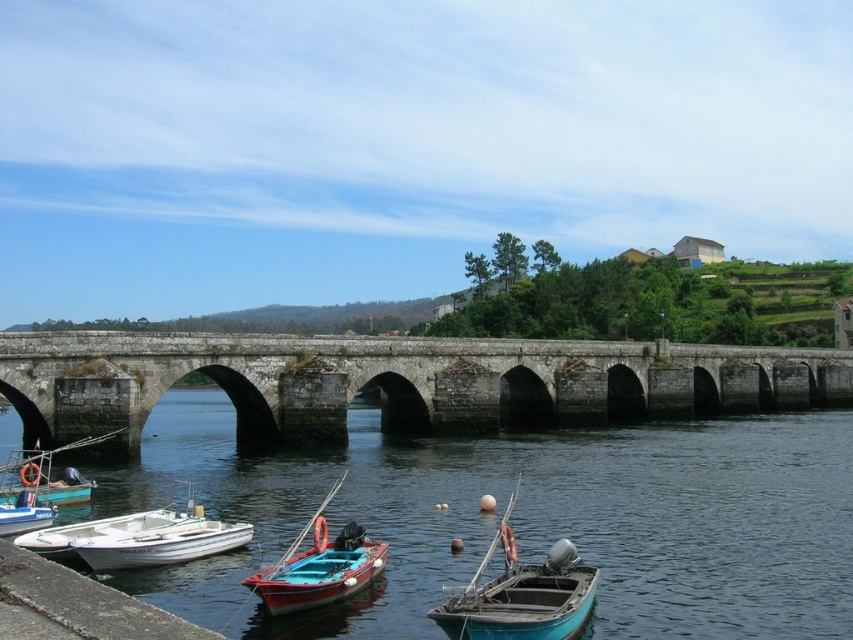
Question: Which is farther from the clear water at center?

Choices:
 (A) wooden boat at center
 (B) white matte boat at lower left
 (C) stone bridge at center
 (D) white plastic boat at lower left

Answer: (D)

Question: Is clear water at center below teal wooden boat at center?

Choices:
 (A) yes
 (B) no

Answer: (A)

Question: Is clear water at center closer to the viewer compared to white matte boat at lower left?

Choices:
 (A) no
 (B) yes

Answer: (B)

Question: Considering the relative positions of clear water at center and teal matte boat at lower left in the image provided, where is clear water at center located with respect to teal matte boat at lower left?

Choices:
 (A) left
 (B) right

Answer: (B)

Question: Considering the real-world distances, which object is farthest from the clear water at center?

Choices:
 (A) stone bridge at center
 (B) teal matte boat at lower left
 (C) white plastic boat at lower left
 (D) wooden boat at center

Answer: (C)

Question: Which point is closer to the camera?

Choices:
 (A) teal matte boat at lower left
 (B) white plastic boat at lower left
 (C) clear water at center

Answer: (C)